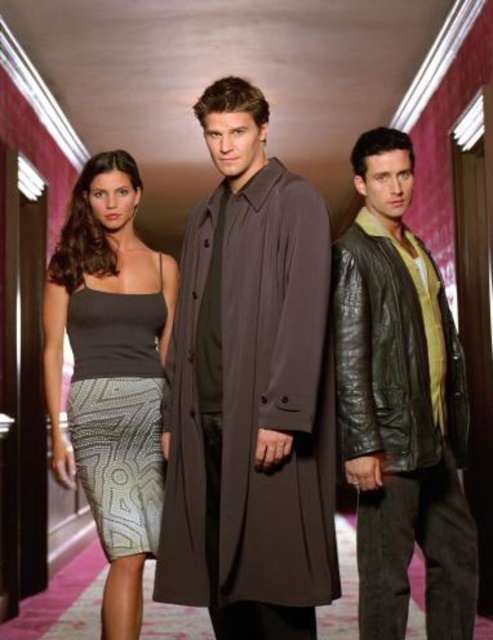
You are a fashion designer observing the three individuals in the hallway. You notice the brown smooth coat at center and the knit fabric tank top at center. Which clothing item is wider?

The brown smooth coat at center is wider than the knit fabric tank top at center.

You are a fashion designer observing the three people in the hallway. You notice the brown smooth coat at center and the knit fabric tank top at center. Which clothing item is taller?

The brown smooth coat at center is taller than the knit fabric tank top at center.